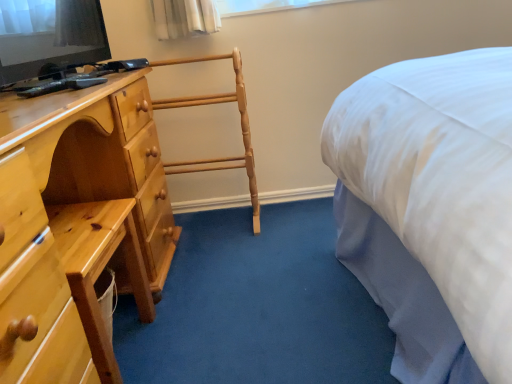
Where is `light brown wood towel rack at center`? The image size is (512, 384). light brown wood towel rack at center is located at coordinates (241, 127).

Image resolution: width=512 pixels, height=384 pixels. What do you see at coordinates (264, 6) in the screenshot?
I see `white glass window at upper center` at bounding box center [264, 6].

Where is `light brown wooden chest of drawers at left`? The height and width of the screenshot is (384, 512). light brown wooden chest of drawers at left is located at coordinates 75,224.

You are a GUI agent. You are given a task and a screenshot of the screen. Output one action in this format:
    pyautogui.click(x=<x>, y=<y>)
    Task: Click on the matte black television at upper left
    
    Given the screenshot: What is the action you would take?
    pyautogui.click(x=49, y=36)

Locate an element on the screen. light brown wood towel rack at center is located at coordinates (241, 127).

From a real-world perspective, does matte black television at upper left sit lower than light brown wooden chest of drawers at left?

Incorrect, from a real-world perspective, matte black television at upper left is higher than light brown wooden chest of drawers at left.

Measure the distance between matte black television at upper left and light brown wooden chest of drawers at left.

matte black television at upper left is 13.88 inches from light brown wooden chest of drawers at left.

Is matte black television at upper left situated inside light brown wooden chest of drawers at left or outside?

matte black television at upper left is located beyond the bounds of light brown wooden chest of drawers at left.

Considering their positions, is matte black television at upper left located in front of or behind light brown wooden chest of drawers at left?

In the image, matte black television at upper left appears behind light brown wooden chest of drawers at left.

Consider the image. Considering the sizes of objects light brown wooden chest of drawers at left and light brown wood towel rack at center in the image provided, who is smaller, light brown wooden chest of drawers at left or light brown wood towel rack at center?

light brown wood towel rack at center.

Is light brown wooden chest of drawers at left with light brown wood towel rack at center?

No, light brown wooden chest of drawers at left is not with light brown wood towel rack at center.

Which object is further away from the camera taking this photo, light brown wooden chest of drawers at left or light brown wood towel rack at center?

light brown wood towel rack at center is further away from the camera.

Who is shorter, white glass window at upper center or light brown wood towel rack at center?

With less height is white glass window at upper center.

From a real-world perspective, which object stands above the other?

white glass window at upper center.

Is white glass window at upper center oriented away from light brown wood towel rack at center?

No, white glass window at upper center's orientation is not away from light brown wood towel rack at center.

Is white glass window at upper center not within light brown wood towel rack at center?

Yes, white glass window at upper center is located beyond the bounds of light brown wood towel rack at center.

Measure the distance between matte black television at upper left and light brown wood towel rack at center.

matte black television at upper left and light brown wood towel rack at center are 17.62 inches apart from each other.

Is the position of matte black television at upper left less distant than that of light brown wood towel rack at center?

Yes, it is.

From the image's perspective, relative to light brown wood towel rack at center, is matte black television at upper left above or below?

matte black television at upper left is situated higher than light brown wood towel rack at center in the image.

The width and height of the screenshot is (512, 384). What are the coordinates of `chair behind the matte black television at upper left` in the screenshot? It's located at (241, 127).

Is light brown wooden chest of drawers at left in front of or behind white glass window at upper center in the image?

Visually, light brown wooden chest of drawers at left is located in front of white glass window at upper center.

From a real-world perspective, is light brown wooden chest of drawers at left positioned over white glass window at upper center based on gravity?

No.

In the scene shown: Considering the sizes of light brown wooden chest of drawers at left and white glass window at upper center in the image, is light brown wooden chest of drawers at left wider or thinner than white glass window at upper center?

light brown wooden chest of drawers at left is wider than white glass window at upper center.

Locate an element on the screen. The image size is (512, 384). chest of drawers below the white glass window at upper center (from the image's perspective) is located at coordinates (75, 224).

The height and width of the screenshot is (384, 512). I want to click on window above the matte black television at upper left (from a real-world perspective), so click(x=264, y=6).

Which of these two, matte black television at upper left or white glass window at upper center, is bigger?

Bigger between the two is matte black television at upper left.

Does matte black television at upper left have a greater width compared to white glass window at upper center?

Yes.

Is matte black television at upper left far from white glass window at upper center?

No.

Can you confirm if light brown wood towel rack at center is shorter than white glass window at upper center?

No, light brown wood towel rack at center is not shorter than white glass window at upper center.

Can white glass window at upper center be found inside light brown wood towel rack at center?

No, white glass window at upper center is located outside of light brown wood towel rack at center.

Does point (157, 104) come closer to viewer compared to point (290, 8)?

Yes, it is in front of point (290, 8).

Does light brown wood towel rack at center have a larger size compared to white glass window at upper center?

Correct, light brown wood towel rack at center is larger in size than white glass window at upper center.

In the image, there is a light brown wooden chest of drawers at left. Where is `television above it (from the image's perspective)`? The height and width of the screenshot is (384, 512). television above it (from the image's perspective) is located at coordinates (49, 36).

This screenshot has height=384, width=512. Find the location of `chair above the light brown wooden chest of drawers at left (from a real-world perspective)`. chair above the light brown wooden chest of drawers at left (from a real-world perspective) is located at coordinates click(x=241, y=127).

Considering their positions, is matte black television at upper left positioned closer to white glass window at upper center than light brown wooden chest of drawers at left?

matte black television at upper left is closer to white glass window at upper center.

When comparing their distances from light brown wood towel rack at center, does light brown wooden chest of drawers at left or white glass window at upper center seem further?

light brown wooden chest of drawers at left is positioned further to the anchor light brown wood towel rack at center.

Estimate the real-world distances between objects in this image. Which object is further from light brown wood towel rack at center, matte black television at upper left or light brown wooden chest of drawers at left?

The object further to light brown wood towel rack at center is light brown wooden chest of drawers at left.

From the image, which object appears to be nearer to matte black television at upper left, light brown wood towel rack at center or white glass window at upper center?

light brown wood towel rack at center is positioned closer to the anchor matte black television at upper left.

Based on their spatial positions, is light brown wooden chest of drawers at left or white glass window at upper center closer to matte black television at upper left?

light brown wooden chest of drawers at left.

From the image, which object appears to be nearer to light brown wood towel rack at center, white glass window at upper center or light brown wooden chest of drawers at left?

white glass window at upper center is closer to light brown wood towel rack at center.

When comparing their distances from matte black television at upper left, does light brown wood towel rack at center or light brown wooden chest of drawers at left seem further?

light brown wood towel rack at center.

From the image, which object appears to be nearer to light brown wood towel rack at center, light brown wooden chest of drawers at left or matte black television at upper left?

matte black television at upper left is closer to light brown wood towel rack at center.

Where is `television between light brown wooden chest of drawers at left and white glass window at upper center along the z-axis`? television between light brown wooden chest of drawers at left and white glass window at upper center along the z-axis is located at coordinates (49, 36).

Identify the location of chair located between matte black television at upper left and white glass window at upper center in the left-right direction. The height and width of the screenshot is (384, 512). (241, 127).

Image resolution: width=512 pixels, height=384 pixels. In order to click on television positioned between light brown wooden chest of drawers at left and light brown wood towel rack at center from near to far in this screenshot , I will do `click(49, 36)`.

Image resolution: width=512 pixels, height=384 pixels. Find the location of `chair between light brown wooden chest of drawers at left and white glass window at upper center along the z-axis`. chair between light brown wooden chest of drawers at left and white glass window at upper center along the z-axis is located at coordinates (241, 127).